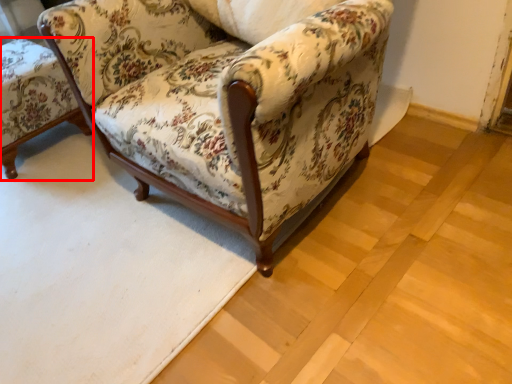
Question: From the image's perspective, where is chair (annotated by the red box) located relative to chair?

Choices:
 (A) below
 (B) above

Answer: (B)